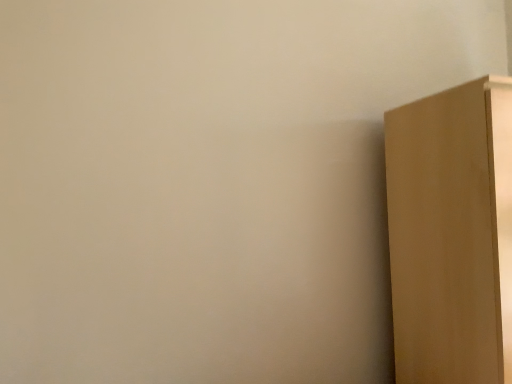
Identify the location of matte cardboard box at right. The height and width of the screenshot is (384, 512). (452, 234).

What is the approximate width of matte cardboard box at right?

The width of matte cardboard box at right is 28.58 inches.

What do you see at coordinates (452, 234) in the screenshot?
I see `matte cardboard box at right` at bounding box center [452, 234].

At what (x,y) coordinates should I click in order to perform the action: click on matte cardboard box at right. Please return your answer as a coordinate pair (x, y). The height and width of the screenshot is (384, 512). Looking at the image, I should click on (452, 234).